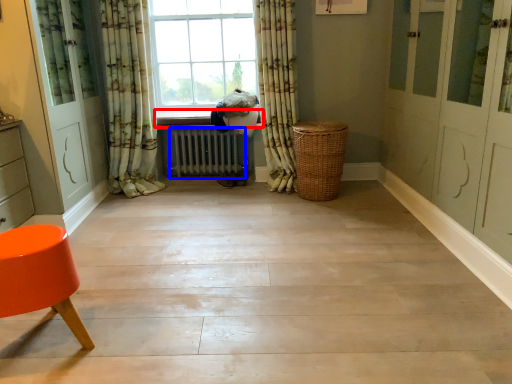
Question: Which of the following is the farthest to the observer, window sill (highlighted by a red box) or radiator (highlighted by a blue box)?

Choices:
 (A) window sill
 (B) radiator

Answer: (B)